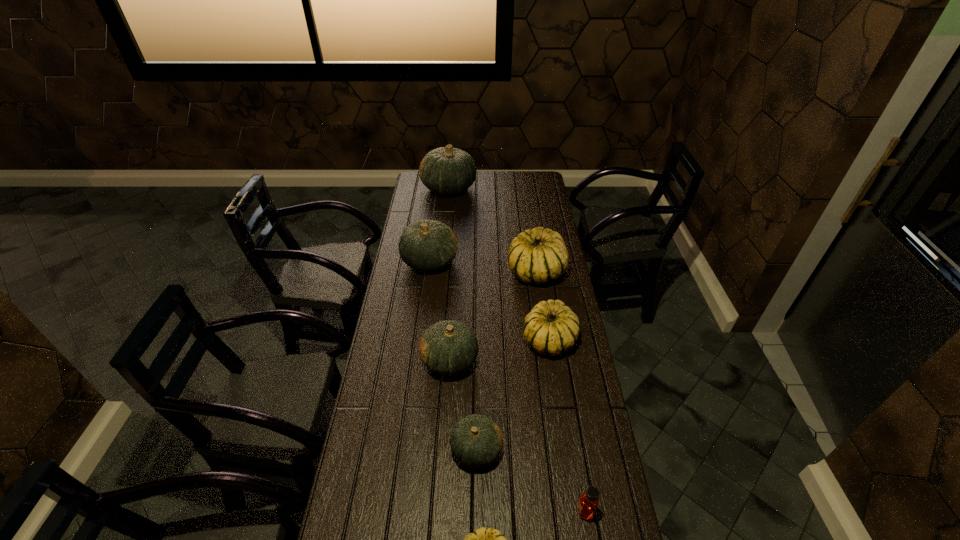
Find the location of a particular element. The image size is (960, 540). the farthest orange gourd is located at coordinates (446, 170).

The height and width of the screenshot is (540, 960). What are the coordinates of `the biggest orange gourd` in the screenshot? It's located at (446, 170).

Where is `the third smallest orange gourd`? The width and height of the screenshot is (960, 540). the third smallest orange gourd is located at coordinates (x=426, y=245).

Identify the location of the biggest white gourd. (535, 256).

This screenshot has height=540, width=960. Identify the location of the third farthest orange gourd. (449, 347).

Where is `the second biggest white gourd`? the second biggest white gourd is located at coordinates (551, 328).

Identify the location of the nearest orange gourd. (476, 441).

Image resolution: width=960 pixels, height=540 pixels. Identify the location of the smallest orange gourd. (476, 441).

The image size is (960, 540). I want to click on the seventh farthest object, so click(588, 502).

This screenshot has width=960, height=540. I want to click on vacant space situated on the right of the farthest gourd, so click(492, 188).